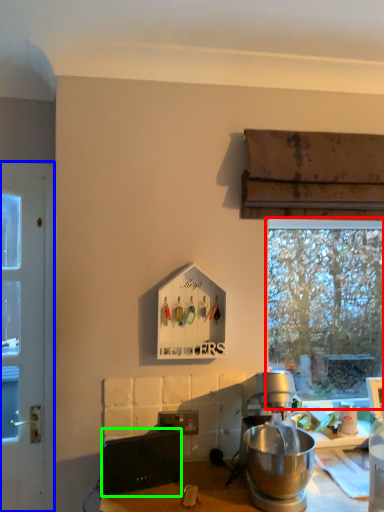
Question: Considering the real-world distances, which object is closest to window (highlighted by a red box)? door (highlighted by a blue box) or appliance (highlighted by a green box).

Choices:
 (A) door
 (B) appliance

Answer: (B)